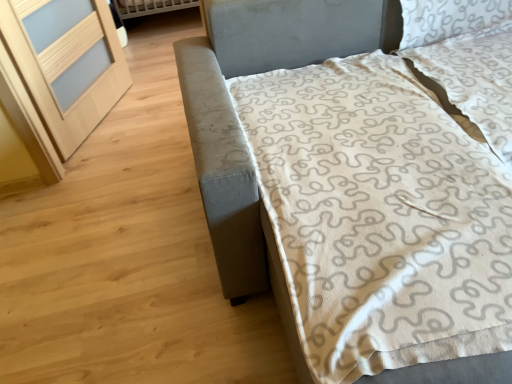
Question: Would you say white textured pillow at upper right is to the left or to the right of textured gray bed at right in the picture?

Choices:
 (A) left
 (B) right

Answer: (B)

Question: From a real-world perspective, is white textured pillow at upper right physically located above or below textured gray bed at right?

Choices:
 (A) below
 (B) above

Answer: (B)

Question: Which object is positioned farthest from the white textured pillow at upper right?

Choices:
 (A) textured gray bed at right
 (B) light wood screen door at left

Answer: (B)

Question: Estimate the real-world distances between objects in this image. Which object is closer to the light wood screen door at left?

Choices:
 (A) textured gray bed at right
 (B) white textured pillow at upper right

Answer: (A)